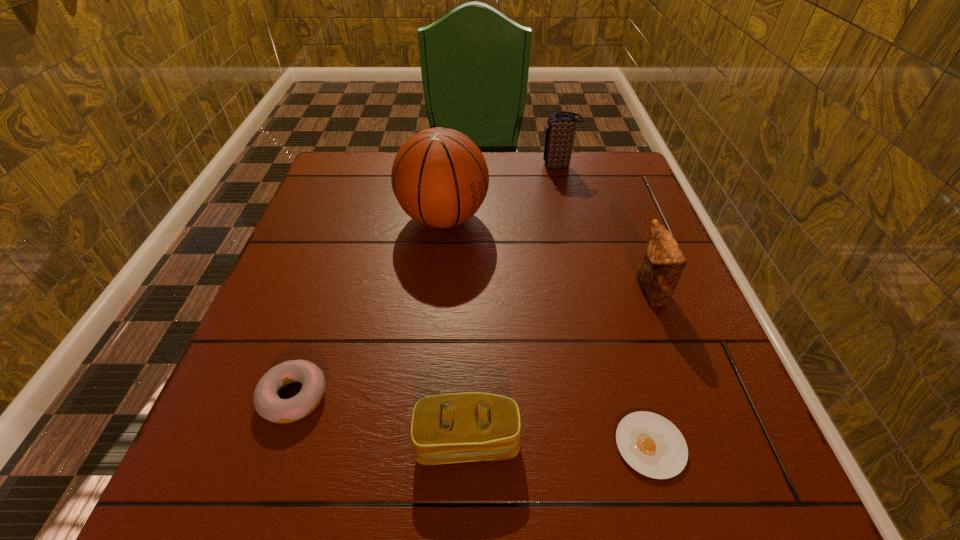
This screenshot has height=540, width=960. What are the coordinates of `the shortest object` in the screenshot? It's located at (652, 445).

At what (x,y) coordinates should I click in order to perform the action: click on vacant area located on the front of the second farthest object. Please return your answer as a coordinate pair (x, y). The image size is (960, 540). Looking at the image, I should click on (433, 329).

Locate an element on the screen. blank area located with the zip open on the farthest clutch bag is located at coordinates tap(513, 166).

In order to click on vacant space located 0.080m with the zip open on the farthest clutch bag in this screenshot , I will do `click(513, 166)`.

The width and height of the screenshot is (960, 540). I want to click on free spot located 0.270m with the zip open on the farthest clutch bag, so click(447, 166).

Locate an element on the screen. blank space located on the open side of the second farthest clutch bag is located at coordinates (503, 292).

I want to click on free space located on the open side of the second farthest clutch bag, so tap(446, 292).

Find the location of a particular element. The width and height of the screenshot is (960, 540). vacant space located 0.200m on the open side of the second farthest clutch bag is located at coordinates (541, 292).

At what (x,y) coordinates should I click in order to perform the action: click on vacant space positioned on the back of the leftmost object. Please return your answer as a coordinate pair (x, y). This screenshot has width=960, height=540. Looking at the image, I should click on (315, 333).

Where is `vacant area located 0.110m on the back of the egg yolk`? This screenshot has height=540, width=960. vacant area located 0.110m on the back of the egg yolk is located at coordinates (626, 358).